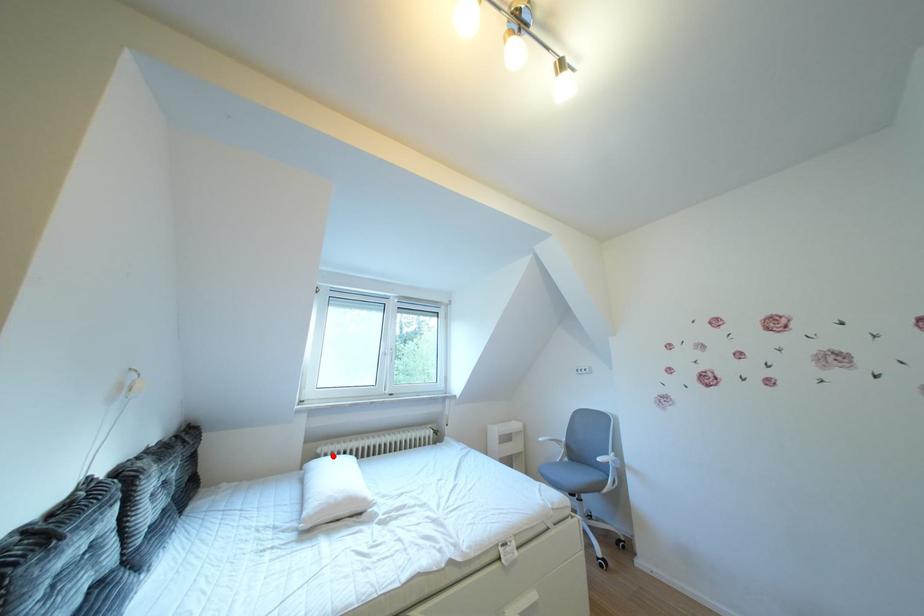
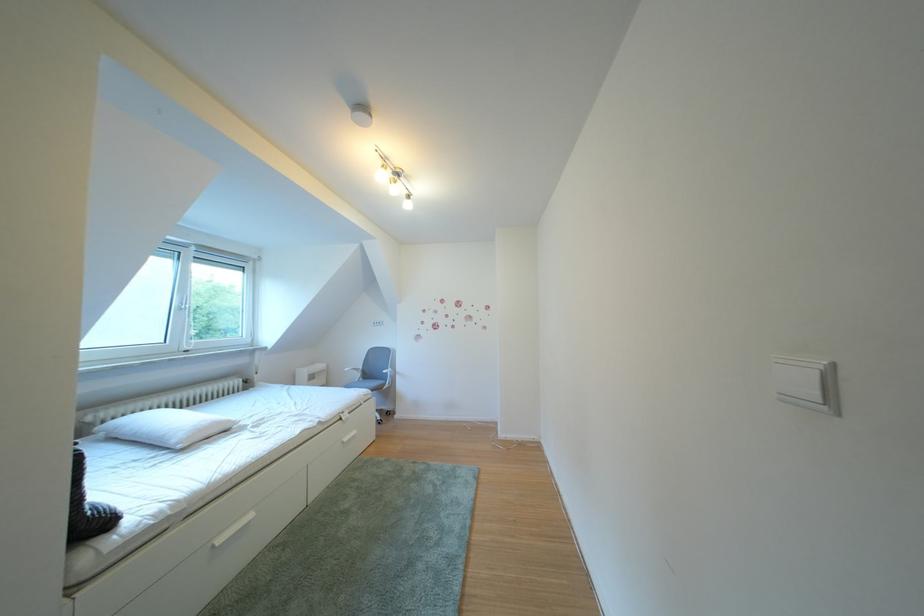
In the second image, find the point that corresponds to the highlighted location in the first image.

(103, 424)